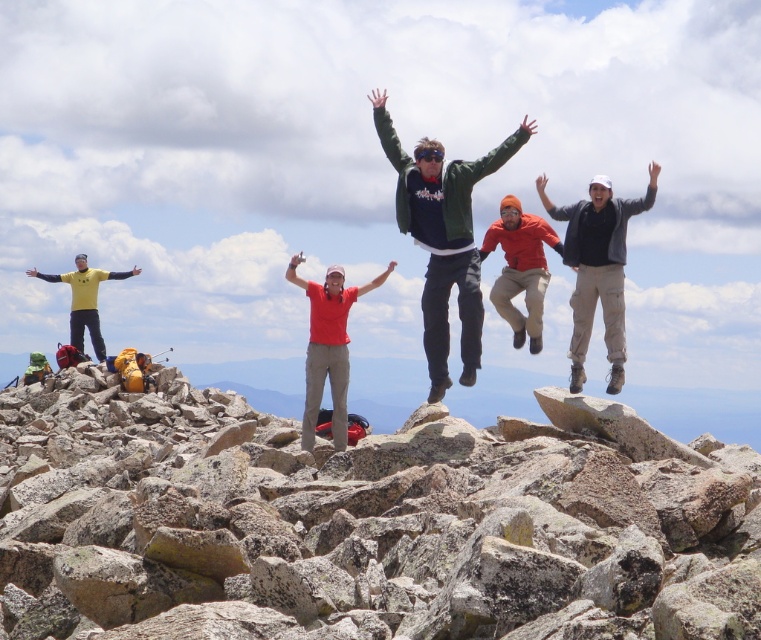
Between matte red shirt at center and orange fabric jacket at center, which one appears on the right side from the viewer's perspective?

From the viewer's perspective, orange fabric jacket at center appears more on the right side.

Who is more forward, (306, 358) or (521, 214)?

Point (521, 214) is more forward.

I want to click on matte red shirt at center, so click(x=328, y=346).

Is green matte jacket at center closer to camera compared to yellow matte shirt at left?

Yes, green matte jacket at center is in front of yellow matte shirt at left.

Is green matte jacket at center above yellow matte shirt at left?

Indeed, green matte jacket at center is positioned over yellow matte shirt at left.

What do you see at coordinates (443, 236) in the screenshot?
I see `green matte jacket at center` at bounding box center [443, 236].

What are the coordinates of `green matte jacket at center` in the screenshot? It's located at 443,236.

Which is above, gray speckled rock at center or yellow matte shirt at left?

yellow matte shirt at left is higher up.

Can you confirm if gray speckled rock at center is smaller than yellow matte shirt at left?

No, gray speckled rock at center is not smaller than yellow matte shirt at left.

The height and width of the screenshot is (640, 761). Identify the location of gray speckled rock at center. coord(363,522).